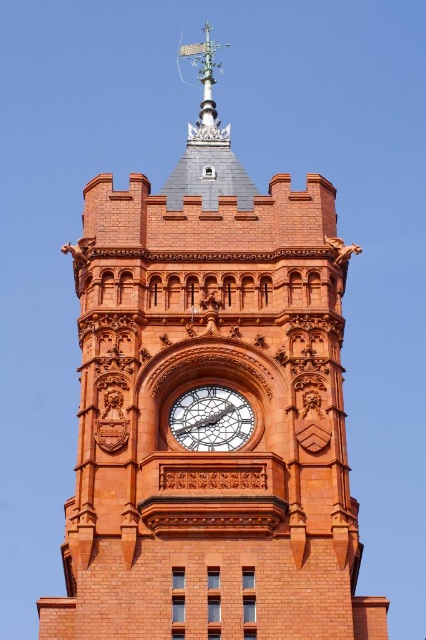
Question: Which object is farther from the camera taking this photo?

Choices:
 (A) polished brass clock at center
 (B) silver metallic weathervane at upper center

Answer: (B)

Question: Does silver metallic weathervane at upper center have a larger size compared to polished brass clock at center?

Choices:
 (A) yes
 (B) no

Answer: (A)

Question: Does silver metallic weathervane at upper center have a greater width compared to polished brass clock at center?

Choices:
 (A) no
 (B) yes

Answer: (B)

Question: Does silver metallic weathervane at upper center lie in front of polished brass clock at center?

Choices:
 (A) yes
 (B) no

Answer: (B)